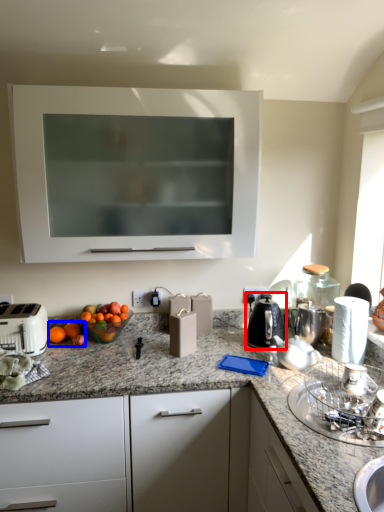
Question: Which of the following is the farthest to the observer, kitchen appliance (highlighted by a red box) or citrus fruit (highlighted by a blue box)?

Choices:
 (A) kitchen appliance
 (B) citrus fruit

Answer: (B)